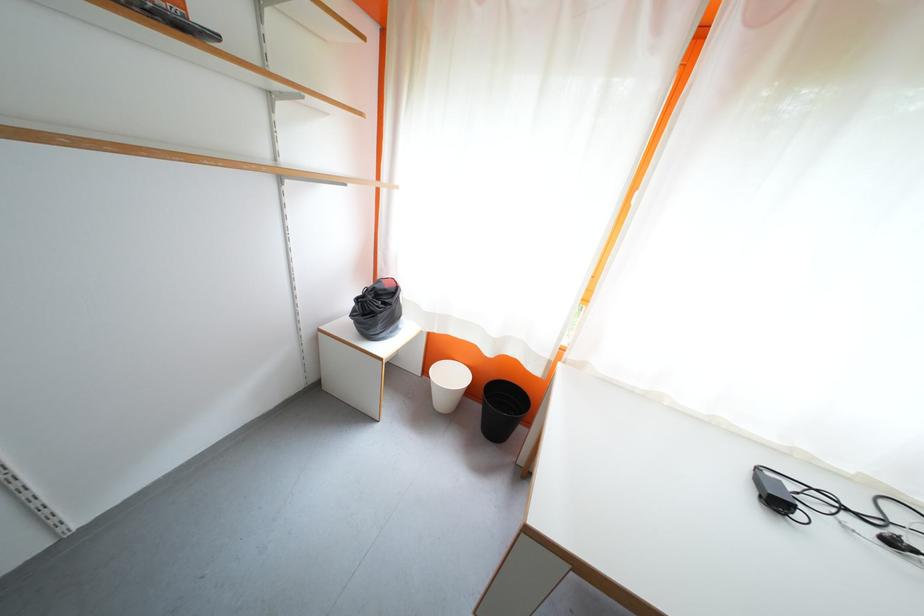
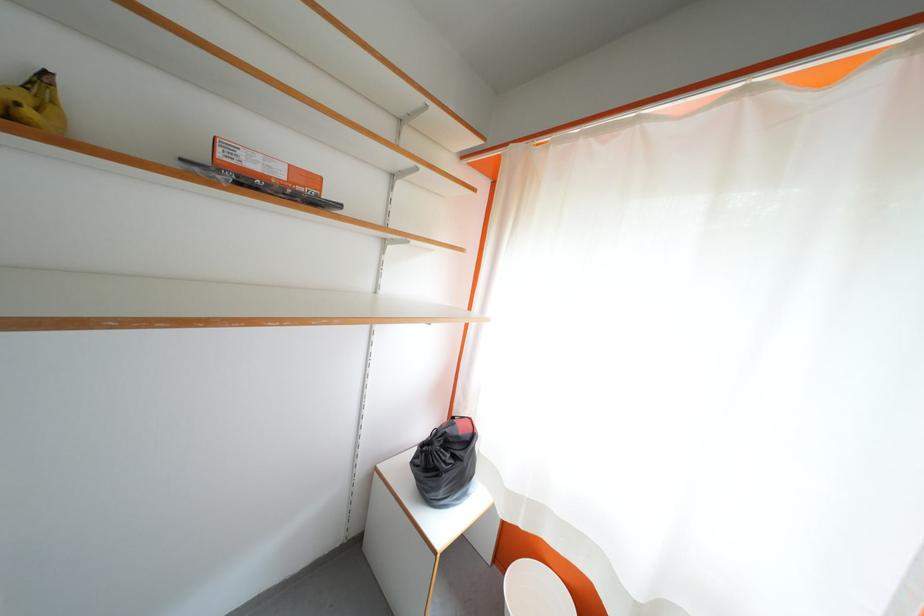
The first image is from the beginning of the video and the second image is from the end. How did the camera likely rotate when shooting the video?

The camera rotated toward left-up.